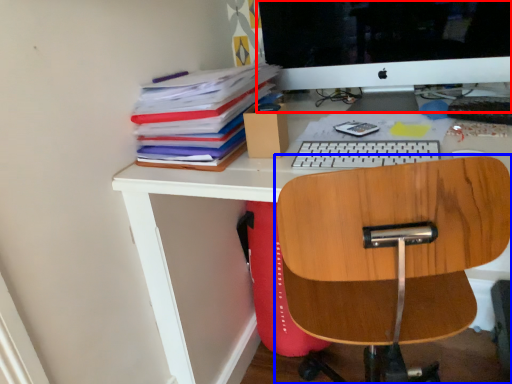
Question: Which object appears closest to the camera in this image, computer monitor (highlighted by a red box) or chair (highlighted by a blue box)?

Choices:
 (A) computer monitor
 (B) chair

Answer: (B)